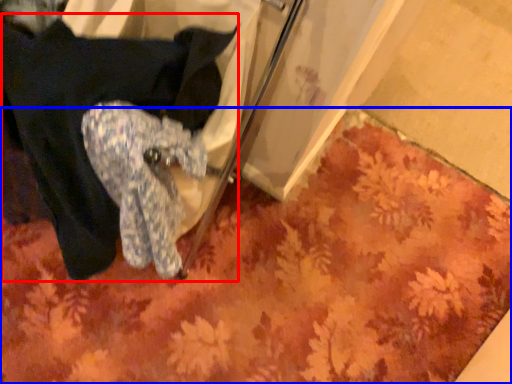
Question: Which object appears farthest to the camera in this image, clothing (highlighted by a red box) or mat (highlighted by a blue box)?

Choices:
 (A) clothing
 (B) mat

Answer: (B)